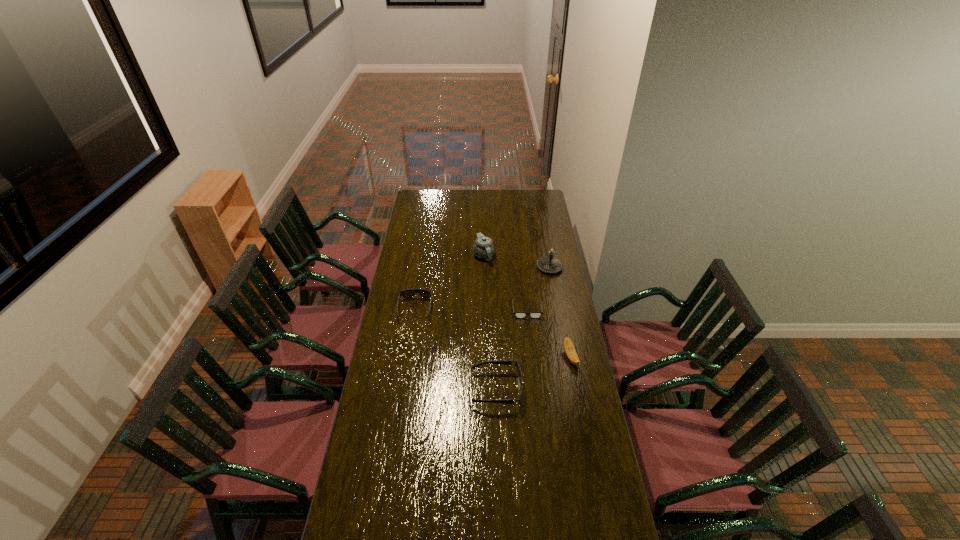
Locate an element on the screen. Image resolution: width=960 pixels, height=540 pixels. vacant place for an extra sunglasses on the right is located at coordinates (616, 505).